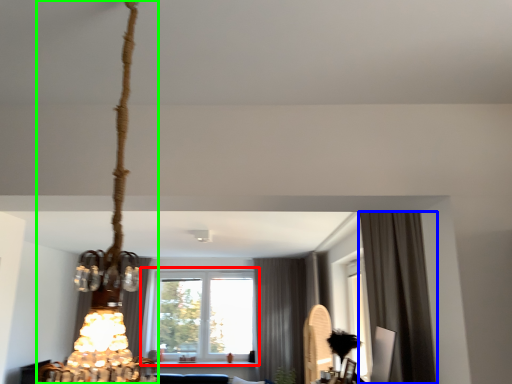
Question: Which is farther away from window (highlighted by a red box)? curtain (highlighted by a blue box) or lamp (highlighted by a green box)?

Choices:
 (A) curtain
 (B) lamp

Answer: (B)